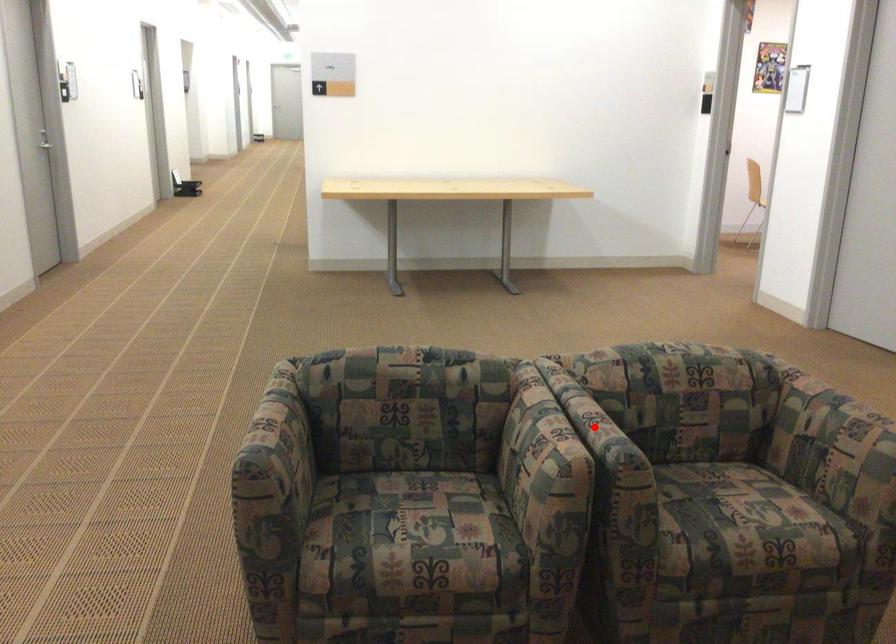
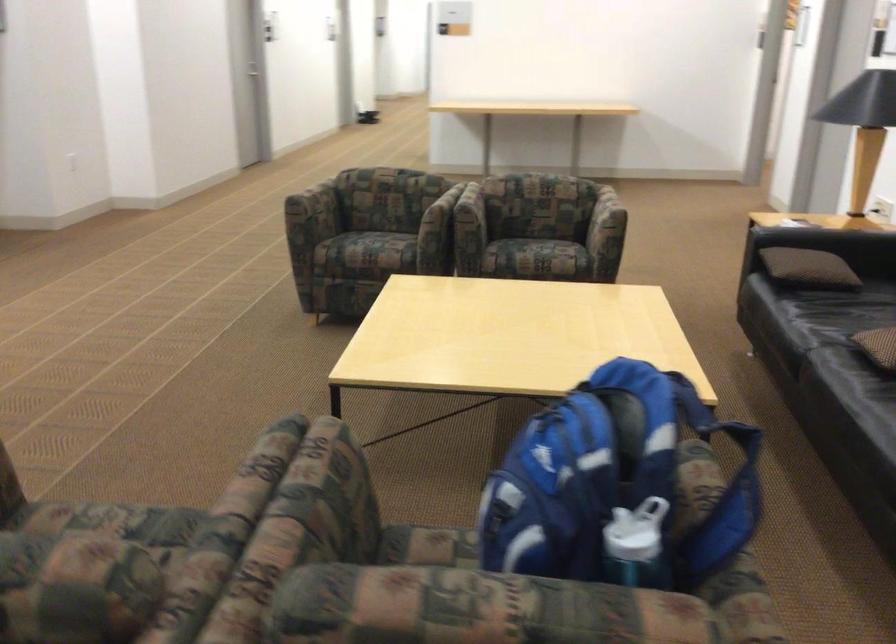
Question: I am providing you with two images of the same scene from different viewpoints. A red point is marked on the first image. At the location where the point appears in image 1, is it still visible in image 2?

Choices:
 (A) Yes
 (B) No

Answer: (B)